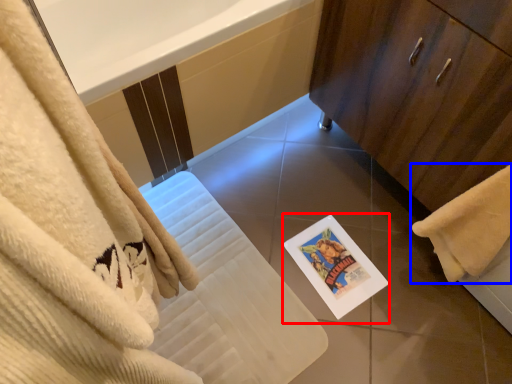
Question: Which point is further to the camera, postcard (highlighted by a red box) or towel (highlighted by a blue box)?

Choices:
 (A) postcard
 (B) towel

Answer: (A)